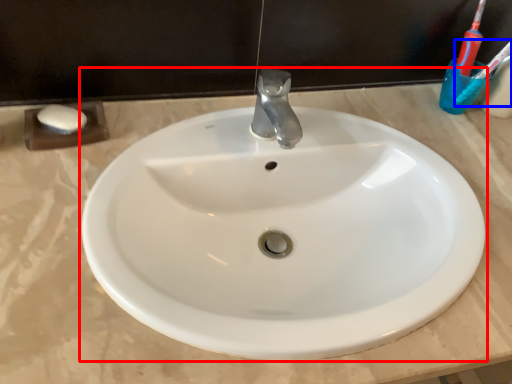
Question: Among these objects, which one is nearest to the camera, sink (highlighted by a red box) or toothbrush (highlighted by a blue box)?

Choices:
 (A) sink
 (B) toothbrush

Answer: (A)